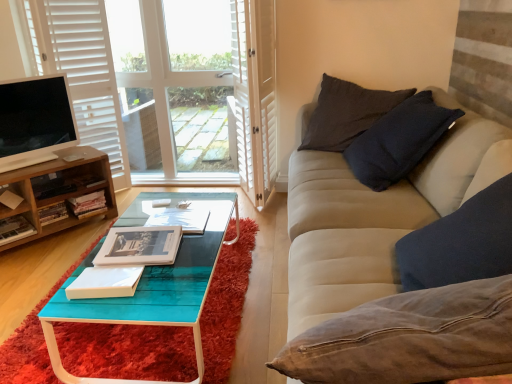
What is the approximate width of teal glossy wood coffee table at center?

teal glossy wood coffee table at center is 37.73 inches wide.

The width and height of the screenshot is (512, 384). Describe the element at coordinates (88, 204) in the screenshot. I see `hardcover books at left, the 6th book viewed from the front` at that location.

Describe the element at coordinates (15, 229) in the screenshot. I see `hardcover book at lower left, the fourth book positioned from the back` at that location.

Based on the photo, what is the approximate width of hardcover book at center, the 7th book from the front?

It is 6.34 inches.

The height and width of the screenshot is (384, 512). Identify the location of beige fabric couch at right. (376, 215).

From the image's perspective, which one is positioned lower, hardcover book at center, the 7th book from the front, or hardcover books at left, the 2th book from the back?

hardcover books at left, the 2th book from the back, appears lower in the image.

Can you tell me how much hardcover book at center, the first book when ordered from back to front, and hardcover books at left, the 6th book viewed from the front, differ in facing direction?

8.05 degrees.

Is there a large distance between hardcover book at center, the first book when ordered from back to front, and hardcover books at left, the 6th book viewed from the front?

No, hardcover book at center, the first book when ordered from back to front, is not far from hardcover books at left, the 6th book viewed from the front.

Considering the sizes of objects hardcover book at center, the 7th book from the front, and hardcover books at left, the 6th book viewed from the front, in the image provided, who is wider, hardcover book at center, the 7th book from the front, or hardcover books at left, the 6th book viewed from the front,?

With larger width is hardcover book at center, the 7th book from the front.

Is white paper book at center, marked as the seventh book in a back-to-front arrangement, not close to beige fabric couch at right?

No.

Considering the relative sizes of white paper book at center, marked as the seventh book in a back-to-front arrangement, and beige fabric couch at right in the image provided, is white paper book at center, marked as the seventh book in a back-to-front arrangement, taller than beige fabric couch at right?

In fact, white paper book at center, marked as the seventh book in a back-to-front arrangement, may be shorter than beige fabric couch at right.

Is white paper book at center, which appears as the 1th book when viewed from the front, at the right side of beige fabric couch at right?

No.

Is white paper book at center, marked as the seventh book in a back-to-front arrangement, bigger or smaller than beige fabric couch at right?

Considering their sizes, white paper book at center, marked as the seventh book in a back-to-front arrangement, takes up less space than beige fabric couch at right.

Does white wood window at upper left contain white matte curtain at left?

That's incorrect, white matte curtain at left is not inside white wood window at upper left.

Does point (190, 46) appear closer or farther from the camera than point (68, 20)?

Point (190, 46) appears to be farther away from the viewer than point (68, 20).

Is white wood window at upper left wider than white matte curtain at left?

Incorrect, the width of white wood window at upper left does not surpass that of white matte curtain at left.

Is white wood window at upper left to the right of white matte curtain at left from the viewer's perspective?

Yes.

Is white glossy television at left looking in the opposite direction of beige fabric couch at right?

white glossy television at left does not have its back to beige fabric couch at right.

From a real-world perspective, between white glossy television at left and beige fabric couch at right, who is vertically lower?

beige fabric couch at right is physically lower.

Does white glossy television at left lie behind beige fabric couch at right?

Yes, white glossy television at left is further from the viewer.

Is white glossy television at left spatially inside beige fabric couch at right, or outside of it?

white glossy television at left is outside beige fabric couch at right.

From a real-world perspective, is wooden cabinet at left located beneath hardcover book at lower left, the fourth book positioned from the back?

Actually, wooden cabinet at left is physically above hardcover book at lower left, the fourth book positioned from the back, in the real world.

Where is `book on the left of wooden cabinet at left`? The width and height of the screenshot is (512, 384). book on the left of wooden cabinet at left is located at coordinates (15, 229).

Who is smaller, wooden cabinet at left or hardcover book at lower left, the fourth book positioned from the back?

With smaller size is hardcover book at lower left, the fourth book positioned from the back.

Is wooden cabinet at left taller or shorter than hardcover book at lower left, the 4th book from the front?

In the image, wooden cabinet at left appears to be taller than hardcover book at lower left, the 4th book from the front.

Is beige fabric couch at right smaller than wooden cabinet at left?

No, beige fabric couch at right is not smaller than wooden cabinet at left.

Is point (458, 128) closer or farther from the camera than point (37, 203)?

Point (458, 128) is positioned closer to the camera compared to point (37, 203).

Does beige fabric couch at right have a lesser width compared to wooden cabinet at left?

In fact, beige fabric couch at right might be wider than wooden cabinet at left.

How far apart are beige fabric couch at right and wooden cabinet at left?

The distance of beige fabric couch at right from wooden cabinet at left is 1.59 meters.

Does matte paper book at center, which appears as the 2th book when viewed from the front, have a larger size compared to hardcover books at left, the 6th book viewed from the front?

Yes, matte paper book at center, which appears as the 2th book when viewed from the front, is bigger than hardcover books at left, the 6th book viewed from the front.

Can you tell me how much matte paper book at center, the 6th book positioned from the back, and hardcover books at left, the 6th book viewed from the front, differ in facing direction?

The angle between the facing direction of matte paper book at center, the 6th book positioned from the back, and the facing direction of hardcover books at left, the 6th book viewed from the front, is 54.7 degrees.

From the image's perspective, which one is positioned higher, matte paper book at center, which appears as the 2th book when viewed from the front, or hardcover books at left, the 6th book viewed from the front?

hardcover books at left, the 6th book viewed from the front, is shown above in the image.

Locate an element on the screen. The height and width of the screenshot is (384, 512). the 1st book below the hardcover book at center, the first book when ordered from back to front (from the image's perspective) is located at coordinates (88, 204).

Where is `the 1st book directly beneath the beige fabric couch at right (from a real-world perspective)`? the 1st book directly beneath the beige fabric couch at right (from a real-world perspective) is located at coordinates (105, 282).

From the image, which object appears to be nearer to beige fabric couch at right, hardcover books at left, the 2th book from the back, or white wood screen door at upper center?

Based on the image, white wood screen door at upper center appears to be nearer to beige fabric couch at right.

Which object lies further to the anchor point beige fabric couch at right, hardcover books at left, the 6th book viewed from the front, or white matte curtain at left?

white matte curtain at left lies further to beige fabric couch at right than the other object.

Looking at this image, considering their positions, is white wood window at upper left positioned closer to teal glossy wood coffee table at center than wooden cabinet at left?

Based on the image, wooden cabinet at left appears to be nearer to teal glossy wood coffee table at center.

From the image, which object appears to be nearer to beige fabric couch at right, matte paper book at center, the 6th book positioned from the back, or wooden cabinet at left?

matte paper book at center, the 6th book positioned from the back, is closer to beige fabric couch at right.

Looking at the image, which one is located further to hardcover books at left, the 2th book from the back, teal glossy wood coffee table at center or hardcover book at center, the third book when ordered from front to back?

teal glossy wood coffee table at center is further to hardcover books at left, the 2th book from the back.

Considering their positions, is white paper book at center, which appears as the 1th book when viewed from the front, positioned further to white glossy television at left than teal glossy wood coffee table at center?

white paper book at center, which appears as the 1th book when viewed from the front, is positioned further to the anchor white glossy television at left.

Which object lies further to the anchor point white glossy television at left, hardcover book at center, which is counted as the fifth book, starting from the back, or white matte curtain at left?

Based on the image, hardcover book at center, which is counted as the fifth book, starting from the back, appears to be further to white glossy television at left.

From the image, which object appears to be farther from white matte curtain at left, teal glossy wood coffee table at center or white wood window at upper left?

The object further to white matte curtain at left is teal glossy wood coffee table at center.

The width and height of the screenshot is (512, 384). Find the location of `book between white matte curtain at left and wooden cabinet at left vertically`. book between white matte curtain at left and wooden cabinet at left vertically is located at coordinates (88, 180).

What are the coordinates of `cabinetry between white glossy television at left and hardcover books at left, the 6th book viewed from the front, in the up-down direction` in the screenshot? It's located at (57, 191).

In order to click on curtain between white paper book at center, marked as the seventh book in a back-to-front arrangement, and wooden bookshelf at left, which appears as the third book when viewed from the back, in the front-back direction in this screenshot , I will do `click(85, 73)`.

At what (x,y) coordinates should I click in order to perform the action: click on coffee table between hardcover book at lower left, the fourth book positioned from the back, and white wood screen door at upper center from left to right. Please return your answer as a coordinate pair (x, y). This screenshot has height=384, width=512. Looking at the image, I should click on (153, 283).